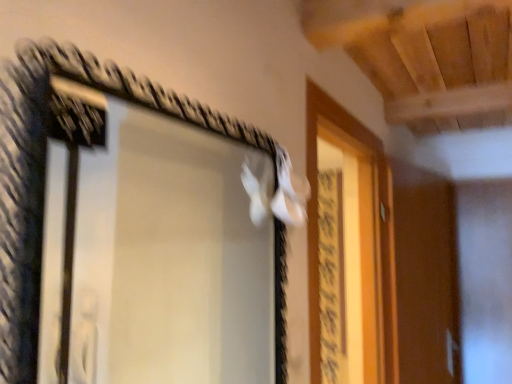
Question: Is white matte screen door at upper right in front of black wire frame mirror at upper left?

Choices:
 (A) yes
 (B) no

Answer: (B)

Question: Does white matte screen door at upper right have a lesser width compared to black wire frame mirror at upper left?

Choices:
 (A) yes
 (B) no

Answer: (B)

Question: Considering the relative positions of white matte screen door at upper right and black wire frame mirror at upper left in the image provided, is white matte screen door at upper right to the right of black wire frame mirror at upper left from the viewer's perspective?

Choices:
 (A) yes
 (B) no

Answer: (A)

Question: From a real-world perspective, is white matte screen door at upper right positioned under black wire frame mirror at upper left based on gravity?

Choices:
 (A) no
 (B) yes

Answer: (B)

Question: From a real-world perspective, is white matte screen door at upper right located higher than black wire frame mirror at upper left?

Choices:
 (A) yes
 (B) no

Answer: (B)

Question: Considering the relative sizes of white matte screen door at upper right and black wire frame mirror at upper left in the image provided, is white matte screen door at upper right taller than black wire frame mirror at upper left?

Choices:
 (A) yes
 (B) no

Answer: (A)

Question: Can white matte screen door at upper right be found inside black wire frame mirror at upper left?

Choices:
 (A) yes
 (B) no

Answer: (B)

Question: Can you confirm if black wire frame mirror at upper left is thinner than white matte screen door at upper right?

Choices:
 (A) yes
 (B) no

Answer: (A)

Question: Does black wire frame mirror at upper left turn towards white matte screen door at upper right?

Choices:
 (A) yes
 (B) no

Answer: (B)

Question: From a real-world perspective, is black wire frame mirror at upper left over white matte screen door at upper right?

Choices:
 (A) no
 (B) yes

Answer: (B)

Question: Considering the relative sizes of black wire frame mirror at upper left and white matte screen door at upper right in the image provided, is black wire frame mirror at upper left shorter than white matte screen door at upper right?

Choices:
 (A) yes
 (B) no

Answer: (A)

Question: Considering the relative sizes of black wire frame mirror at upper left and white matte screen door at upper right in the image provided, is black wire frame mirror at upper left bigger than white matte screen door at upper right?

Choices:
 (A) yes
 (B) no

Answer: (B)

Question: From the image's perspective, relative to white matte screen door at upper right, is black wire frame mirror at upper left above or below?

Choices:
 (A) below
 (B) above

Answer: (B)